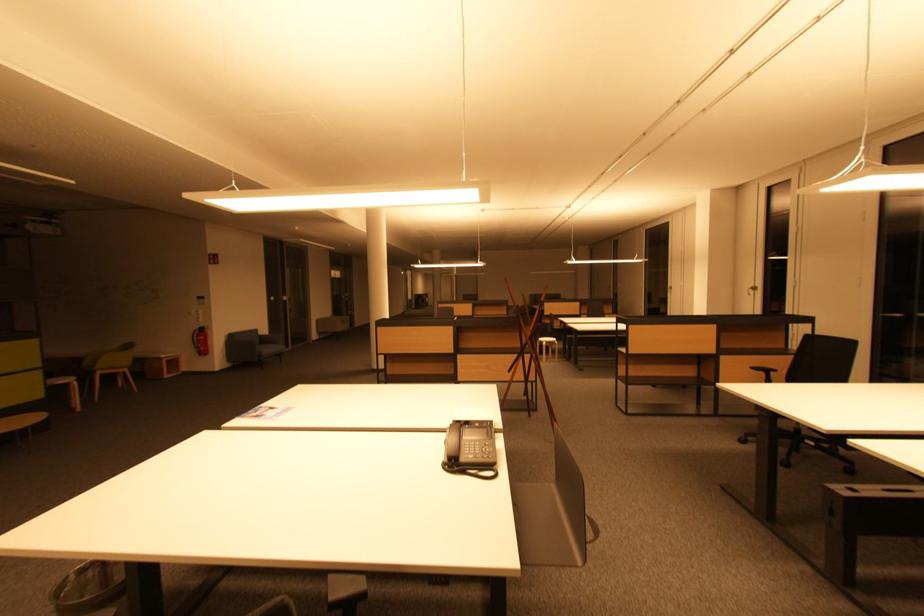
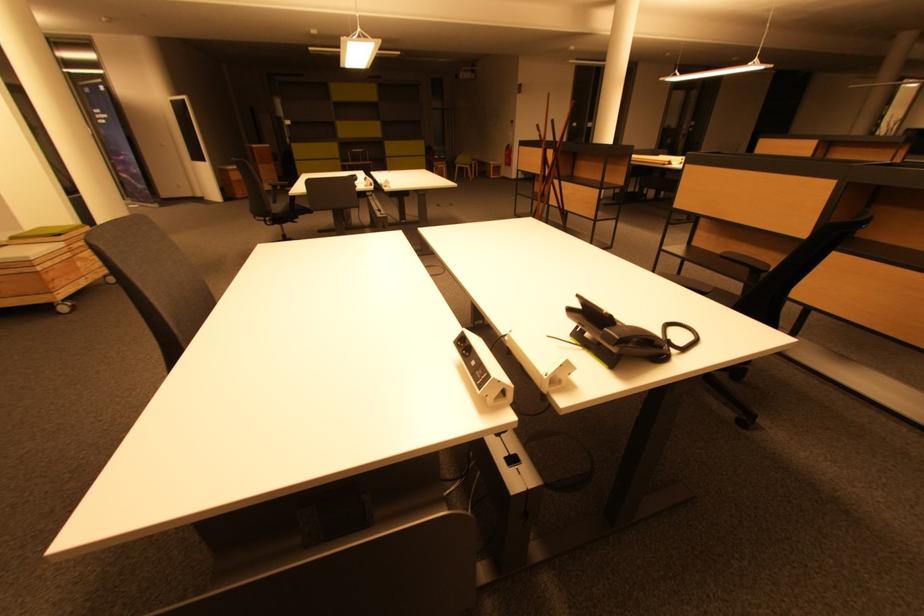
The point at (205, 339) is marked in the first image. Where is the corresponding point in the second image?

(512, 155)